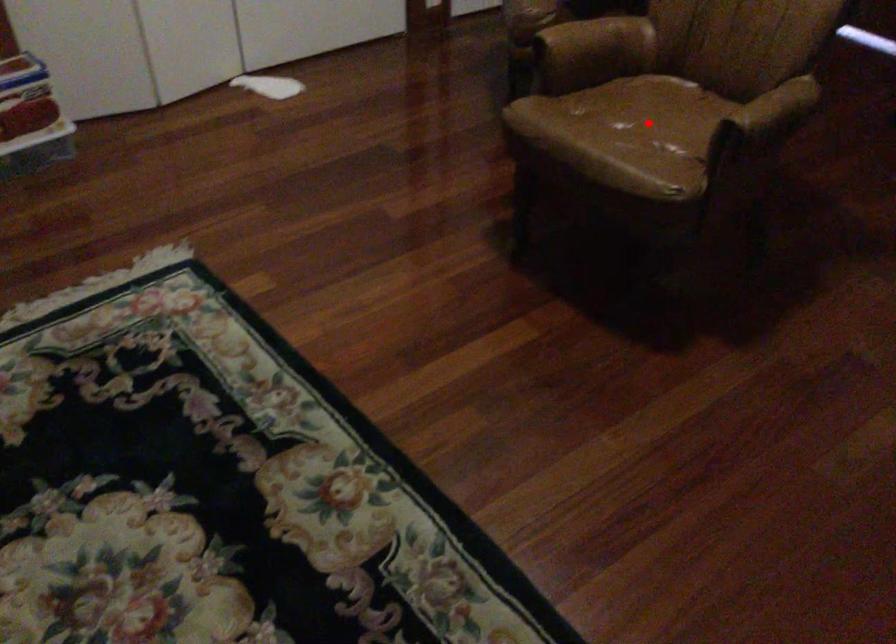
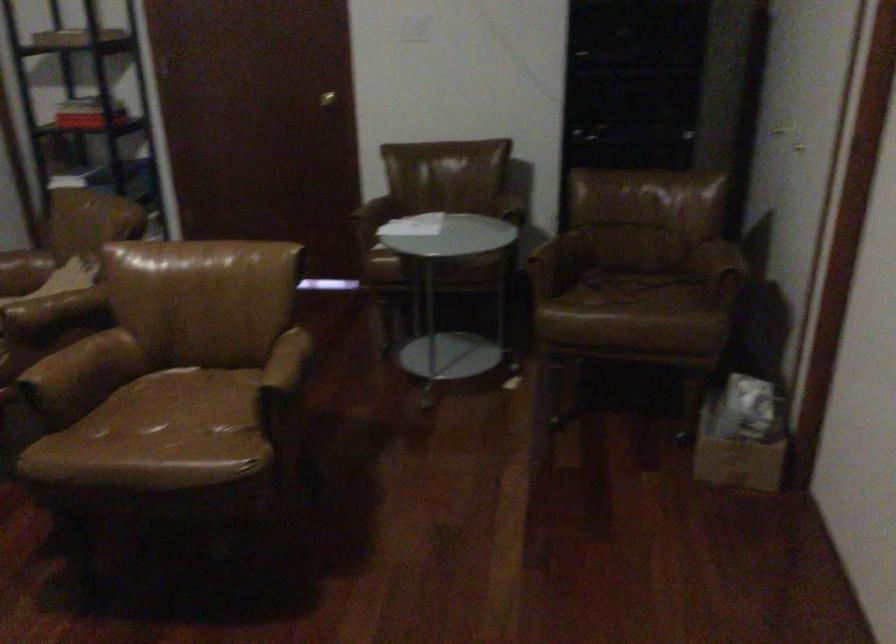
The point at the highlighted location is marked in the first image. Where is the corresponding point in the second image?

(178, 413)